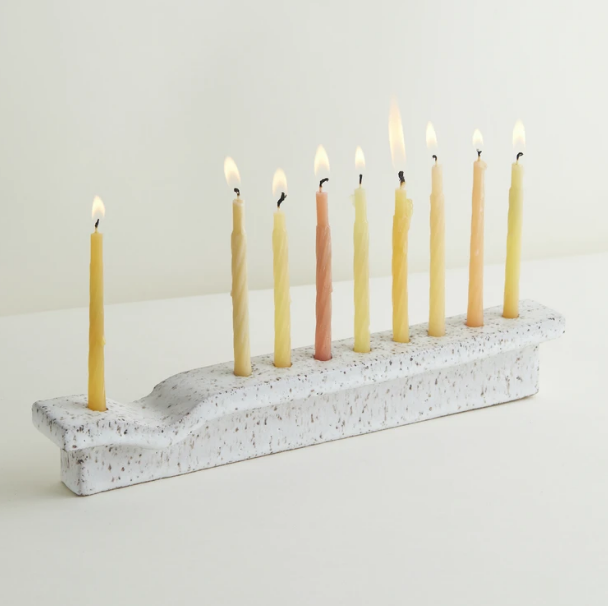
Identify the location of holder. (278, 400).